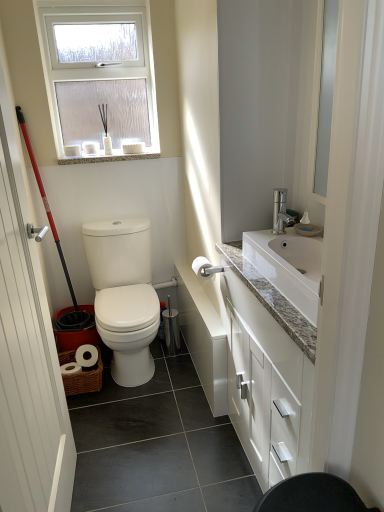
You are a GUI agent. You are given a task and a screenshot of the screen. Output one action in this format:
    pyautogui.click(x=<x>, y=<y>)
    Task: Click on the white frosted glass window at upper center
    Image resolution: width=384 pixels, height=512 pixels.
    Given the screenshot: What is the action you would take?
    [x=98, y=70]

Identify the location of white glossy toilet at center-left. 124,295.

Consider the image. Measure the distance between point (198, 266) and camera.

They are 1.95 meters apart.

The height and width of the screenshot is (512, 384). Identify the location of white frosted glass window at upper center. [x=98, y=70].

In the scene shown: What's the angular difference between white wooden door at left and white frosted glass window at upper center's facing directions?

There is a 88.5-degree angle between the facing directions of white wooden door at left and white frosted glass window at upper center.

Considering their positions, is white wooden door at left located in front of or behind white frosted glass window at upper center?

In the image, white wooden door at left appears in front of white frosted glass window at upper center.

Is white wooden door at left oriented away from white frosted glass window at upper center?

white wooden door at left is not turned away from white frosted glass window at upper center.

Does point (61, 465) come closer to viewer compared to point (63, 76)?

Yes, it is.

Does white matte toilet paper at center appear on the left side of white glossy toilet at center-left?

In fact, white matte toilet paper at center is to the right of white glossy toilet at center-left.

Would you say white matte toilet paper at center is a long distance from white glossy toilet at center-left?

No, there isn't a large distance between white matte toilet paper at center and white glossy toilet at center-left.

Considering their positions, is white matte toilet paper at center located in front of or behind white glossy toilet at center-left?

Visually, white matte toilet paper at center is located in front of white glossy toilet at center-left.

Can you tell me how much white matte toilet paper at center and white glossy toilet at center-left differ in facing direction?

The angle between the facing direction of white matte toilet paper at center and the facing direction of white glossy toilet at center-left is 2.2 degrees.

Is white glossy toilet at center-left smaller than white glossy cabinet at right?

Yes.

In the image, is white glossy toilet at center-left on the left side or the right side of white glossy cabinet at right?

Clearly, white glossy toilet at center-left is on the left of white glossy cabinet at right in the image.

Are white glossy toilet at center-left and white glossy cabinet at right far apart?

No, there isn't a large distance between white glossy toilet at center-left and white glossy cabinet at right.

Measure the distance between white glossy cabinet at right and white matte toilet paper at center.

The distance of white glossy cabinet at right from white matte toilet paper at center is 20.59 inches.

Can you confirm if white glossy cabinet at right is taller than white matte toilet paper at center?

Indeed, white glossy cabinet at right has a greater height compared to white matte toilet paper at center.

Looking at this image, is white matte toilet paper at center completely or partially inside white glossy cabinet at right?

No, white matte toilet paper at center is not a part of white glossy cabinet at right.

This screenshot has height=512, width=384. I want to click on bathroom cabinet that is in front of the white matte toilet paper at center, so click(x=272, y=348).

Are white frosted glass window at upper center and white wooden door at left making contact?

No, white frosted glass window at upper center is not in contact with white wooden door at left.

Which of these two, white frosted glass window at upper center or white wooden door at left, is thinner?

Thinner between the two is white wooden door at left.

Can you confirm if white frosted glass window at upper center is smaller than white wooden door at left?

Indeed, white frosted glass window at upper center has a smaller size compared to white wooden door at left.

Does white frosted glass window at upper center turn towards white wooden door at left?

Yes, white frosted glass window at upper center is oriented towards white wooden door at left.

Considering the relative sizes of white glossy cabinet at right and white frosted glass window at upper center in the image provided, is white glossy cabinet at right thinner than white frosted glass window at upper center?

No.

Is white glossy cabinet at right situated inside white frosted glass window at upper center or outside?

white glossy cabinet at right is located beyond the bounds of white frosted glass window at upper center.

Considering the points (261, 280) and (74, 104), which point is behind, point (261, 280) or point (74, 104)?

Point (74, 104)

How many degrees apart are the facing directions of white glossy cabinet at right and white frosted glass window at upper center?

They differ by 90 degrees in their facing directions.

Is white wooden door at left completely or partially outside of white glossy cabinet at right?

Absolutely, white wooden door at left is external to white glossy cabinet at right.

From a real-world perspective, is white wooden door at left positioned under white glossy cabinet at right based on gravity?

No, from a real-world perspective, white wooden door at left is not under white glossy cabinet at right.

In the scene shown: Is there a large distance between white wooden door at left and white glossy cabinet at right?

That's not correct — white wooden door at left is a little close to white glossy cabinet at right.

Considering the sizes of white wooden door at left and white glossy cabinet at right in the image, is white wooden door at left wider or thinner than white glossy cabinet at right?

white wooden door at left is thinner than white glossy cabinet at right.

At what (x,y) coordinates should I click in order to perform the action: click on window above the white wooden door at left (from a real-world perspective). Please return your answer as a coordinate pair (x, y). Looking at the image, I should click on (98, 70).

Image resolution: width=384 pixels, height=512 pixels. I want to click on toilet on the left of white matte toilet paper at center, so click(x=124, y=295).

Estimate the real-world distances between objects in this image. Which object is further from white glossy toilet at center-left, white matte toilet paper at center or white wooden door at left?

The object further to white glossy toilet at center-left is white wooden door at left.

Estimate the real-world distances between objects in this image. Which object is further from white frosted glass window at upper center, white wooden door at left or white matte toilet paper at center?

white wooden door at left is further to white frosted glass window at upper center.

Consider the image. When comparing their distances from white wooden door at left, does white glossy toilet at center-left or white glossy cabinet at right seem closer?

The object closer to white wooden door at left is white glossy cabinet at right.

From the image, which object appears to be farther from white glossy toilet at center-left, white glossy cabinet at right or white wooden door at left?

Based on the image, white wooden door at left appears to be further to white glossy toilet at center-left.

Which object lies nearer to the anchor point white matte toilet paper at center, white wooden door at left or white glossy toilet at center-left?

white glossy toilet at center-left is closer to white matte toilet paper at center.

Based on their spatial positions, is white glossy toilet at center-left or white matte toilet paper at center closer to white wooden door at left?

white glossy toilet at center-left lies closer to white wooden door at left than the other object.

When comparing their distances from white frosted glass window at upper center, does white matte toilet paper at center or white wooden door at left seem closer?

white matte toilet paper at center is closer to white frosted glass window at upper center.

Looking at the image, which one is located closer to white glossy cabinet at right, white matte toilet paper at center or white frosted glass window at upper center?

white matte toilet paper at center is closer to white glossy cabinet at right.

Where is `toilet between white frosted glass window at upper center and white glossy cabinet at right in the up-down direction`? The height and width of the screenshot is (512, 384). toilet between white frosted glass window at upper center and white glossy cabinet at right in the up-down direction is located at coordinates (124, 295).

The height and width of the screenshot is (512, 384). In order to click on toilet paper between white frosted glass window at upper center and white glossy cabinet at right in the up-down direction in this screenshot , I will do `click(201, 266)`.

The width and height of the screenshot is (384, 512). Find the location of `bathroom cabinet positioned between white wooden door at left and white matte toilet paper at center from near to far`. bathroom cabinet positioned between white wooden door at left and white matte toilet paper at center from near to far is located at coordinates (272, 348).

Find the location of a particular element. toilet paper between white frosted glass window at upper center and white glossy toilet at center-left vertically is located at coordinates (201, 266).